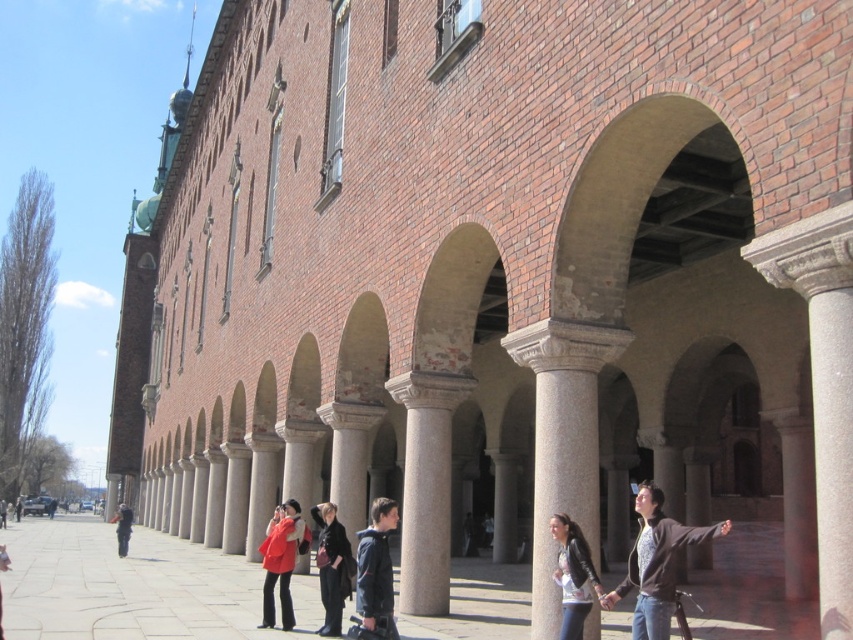
You are standing in front of the historic building and want to pick up the dark brown leather jacket at lower right. To reach it, you need to walk around the smooth stone column at center. Since the column is in the way, which direction should you go around it to avoid the column?

The smooth stone column at center is closer to you than the dark brown leather jacket at lower right, so you should walk around the column either to the left or right side to reach the jacket without obstruction.

You are standing at the base of the historic building and notice both the smooth concrete pavement at center and the black leather jacket at center. If you want to pick up the jacket, will you have to walk more than 90 feet to reach it from where you are standing?

The smooth concrete pavement at center and black leather jacket at center are 89.49 feet apart. Since 89.49 feet is less than 90 feet, you would not need to walk more than 90 feet to reach the jacket.

You are an architect examining the building and notice the smooth stone column at center and the dark brown leather jacket at lower right. Which object has a smaller diameter?

The smooth stone column at center is thinner than the dark brown leather jacket at lower right, so the smooth stone column at center has a smaller diameter.